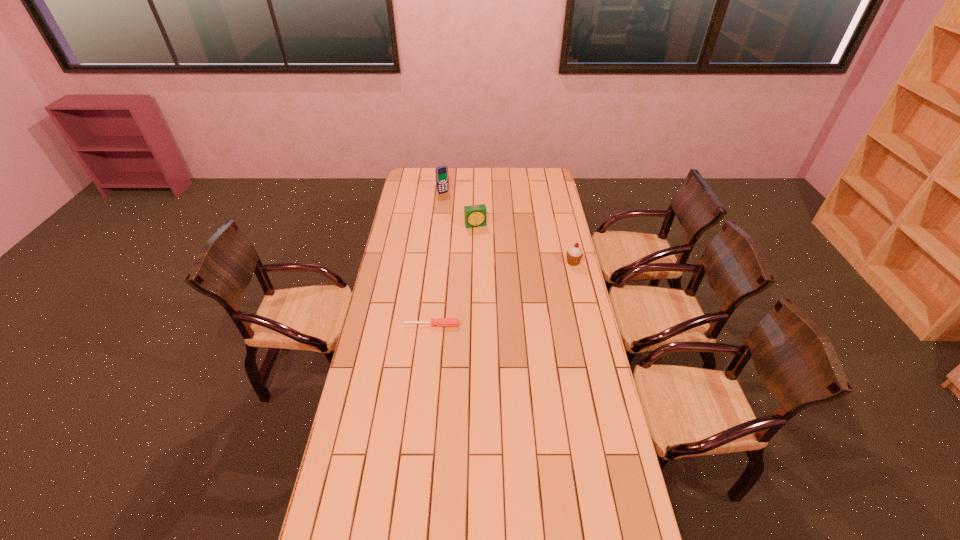
This screenshot has height=540, width=960. I want to click on free space on the desktop that is between the nearest object and the rightmost object and is positioned on the front-facing side of the alarm clock, so click(x=498, y=295).

I want to click on free space on the desktop that is between the shortest object and the second nearest object and is positioned on the front-facing side of the tallest object, so coord(519,286).